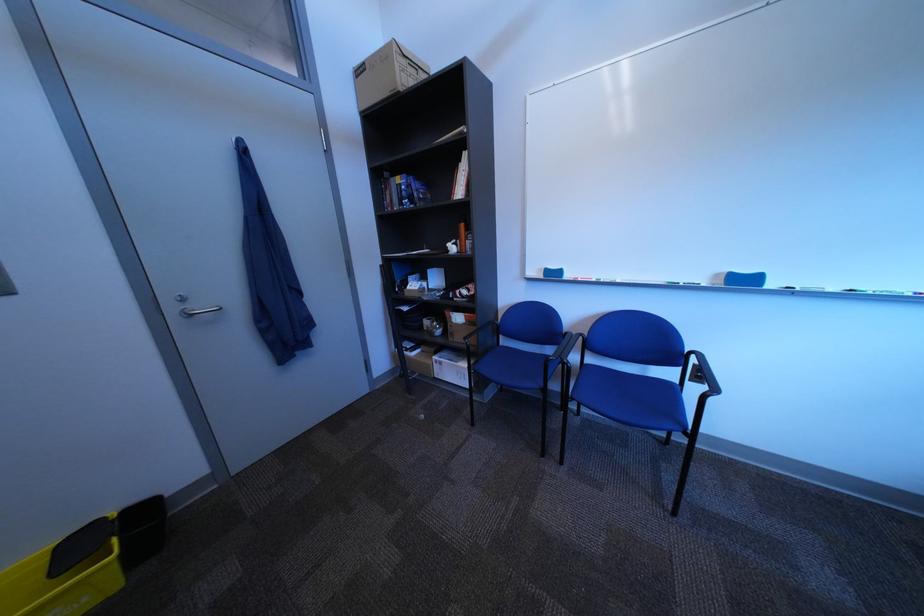
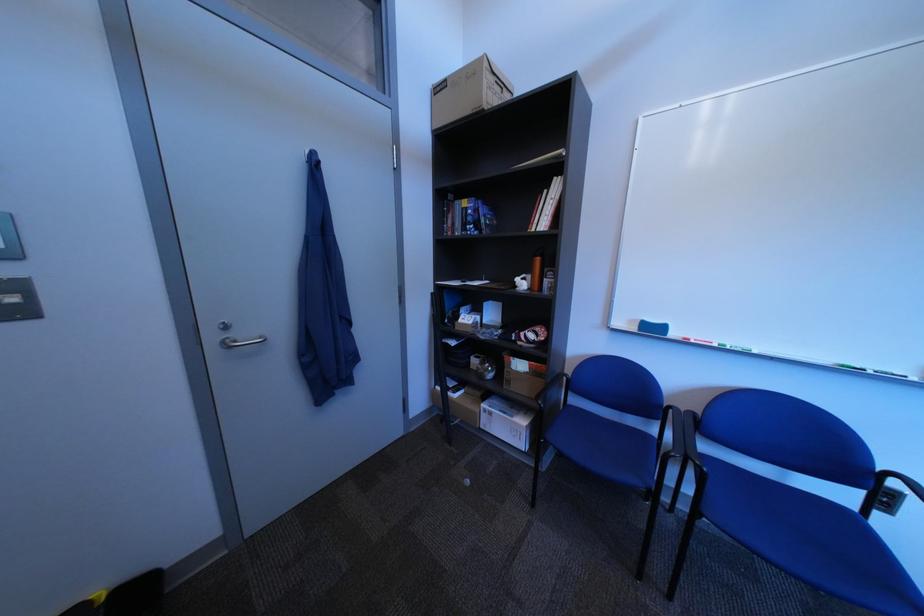
Locate, in the second image, the point that corresponds to the point at 187,310 in the first image.

(226, 339)